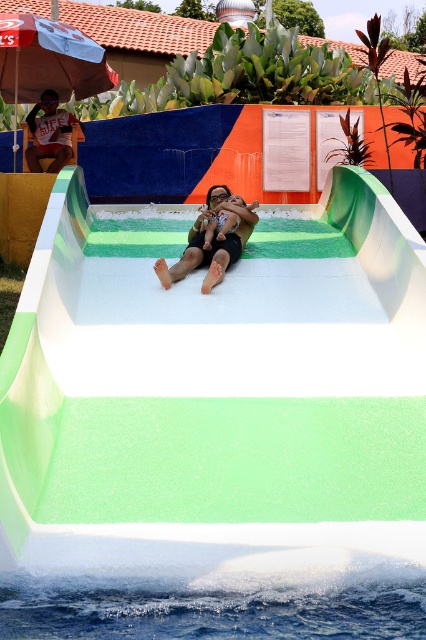
Question: Among these objects, which one is nearest to the camera?

Choices:
 (A) matte black swimsuit at center
 (B) matte white person at center
 (C) transparent plastic goggles at upper center
 (D) green rubber pool at center

Answer: (D)

Question: Which point is farther from the camera taking this photo?

Choices:
 (A) (232, 202)
 (B) (2, 378)
 (C) (68, 113)
 (D) (221, 196)

Answer: (C)

Question: Which of the following is the closest to the observer?

Choices:
 (A) (221, 188)
 (B) (71, 42)
 (C) (206, 227)
 (D) (268, 298)

Answer: (D)

Question: Does white fabric umbrella at upper left appear under matte white t-shirt at upper left?

Choices:
 (A) no
 (B) yes

Answer: (A)

Question: Does matte white t-shirt at upper left have a smaller size compared to matte black swimsuit at center?

Choices:
 (A) yes
 (B) no

Answer: (B)

Question: Is the position of matte white person at center less distant than that of matte white t-shirt at upper left?

Choices:
 (A) yes
 (B) no

Answer: (A)